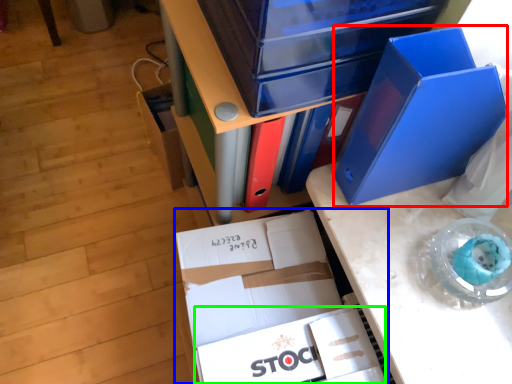
Question: Which is farther away from paperback book (highlighted by a red box)? box (highlighted by a blue box) or paperback book (highlighted by a green box)?

Choices:
 (A) box
 (B) paperback book

Answer: (B)